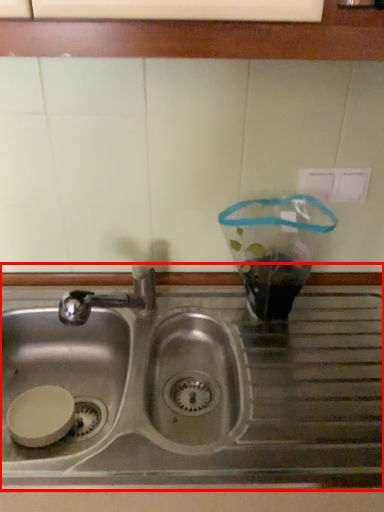
Question: From the image's perspective, where is sink (annotated by the red box) located in relation to window sill in the image?

Choices:
 (A) above
 (B) below

Answer: (B)